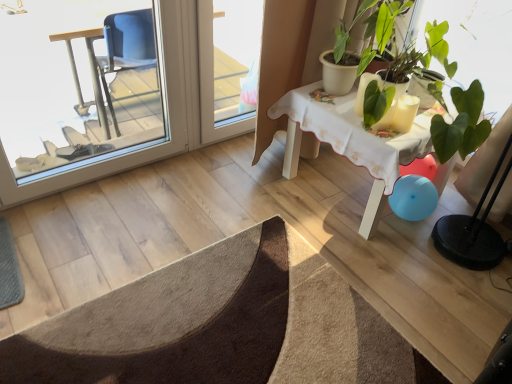
Question: Considering the relative sizes of white wooden table at upper right and transparent plastic screen door at upper center, marked as the 1th screen door in a right-to-left arrangement, in the image provided, is white wooden table at upper right shorter than transparent plastic screen door at upper center, marked as the 1th screen door in a right-to-left arrangement,?

Choices:
 (A) no
 (B) yes

Answer: (B)

Question: Does white wooden table at upper right have a larger size compared to transparent plastic screen door at upper center, which ranks as the 2th screen door in left-to-right order?

Choices:
 (A) no
 (B) yes

Answer: (B)

Question: Is white wooden table at upper right beside transparent plastic screen door at upper center, marked as the 1th screen door in a right-to-left arrangement?

Choices:
 (A) yes
 (B) no

Answer: (B)

Question: Does white wooden table at upper right have a lesser width compared to transparent plastic screen door at upper center, which ranks as the 2th screen door in left-to-right order?

Choices:
 (A) no
 (B) yes

Answer: (A)

Question: Is white wooden table at upper right positioned far away from transparent plastic screen door at upper center, which ranks as the 2th screen door in left-to-right order?

Choices:
 (A) yes
 (B) no

Answer: (B)

Question: From the image's perspective, is white wooden table at upper right located above or below white glossy candle at upper right?

Choices:
 (A) above
 (B) below

Answer: (B)

Question: Looking at the image, does white wooden table at upper right seem bigger or smaller compared to white glossy candle at upper right?

Choices:
 (A) small
 (B) big

Answer: (B)

Question: Does point click(x=329, y=115) appear closer or farther from the camera than point click(x=406, y=115)?

Choices:
 (A) farther
 (B) closer

Answer: (A)

Question: From a real-world perspective, is white wooden table at upper right physically located above or below white glossy candle at upper right?

Choices:
 (A) above
 (B) below

Answer: (B)

Question: Do you think brown textured doormat at lower left is within transparent plastic screen door at upper center, marked as the 1th screen door in a right-to-left arrangement, or outside of it?

Choices:
 (A) inside
 (B) outside

Answer: (B)

Question: From a real-world perspective, relative to transparent plastic screen door at upper center, which ranks as the 2th screen door in left-to-right order, is brown textured doormat at lower left vertically above or below?

Choices:
 (A) below
 (B) above

Answer: (A)

Question: Is point (170, 312) positioned closer to the camera than point (224, 91)?

Choices:
 (A) farther
 (B) closer

Answer: (B)

Question: From the image's perspective, relative to transparent plastic screen door at upper center, marked as the 1th screen door in a right-to-left arrangement, is brown textured doormat at lower left above or below?

Choices:
 (A) above
 (B) below

Answer: (B)

Question: Considering the positions of transparent glass screen door at left, placed as the second screen door when sorted from right to left, and white glossy candle at upper right in the image, is transparent glass screen door at left, placed as the second screen door when sorted from right to left, taller or shorter than white glossy candle at upper right?

Choices:
 (A) tall
 (B) short

Answer: (A)

Question: Is transparent glass screen door at left, placed as the second screen door when sorted from right to left, to the left or to the right of white glossy candle at upper right in the image?

Choices:
 (A) right
 (B) left

Answer: (B)